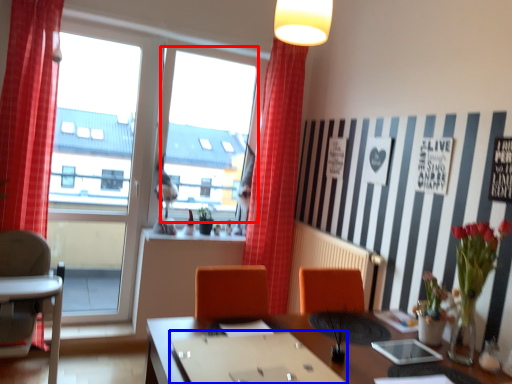
Question: Which point is further to the camera, window screen (highlighted by a red box) or round table (highlighted by a blue box)?

Choices:
 (A) window screen
 (B) round table

Answer: (A)